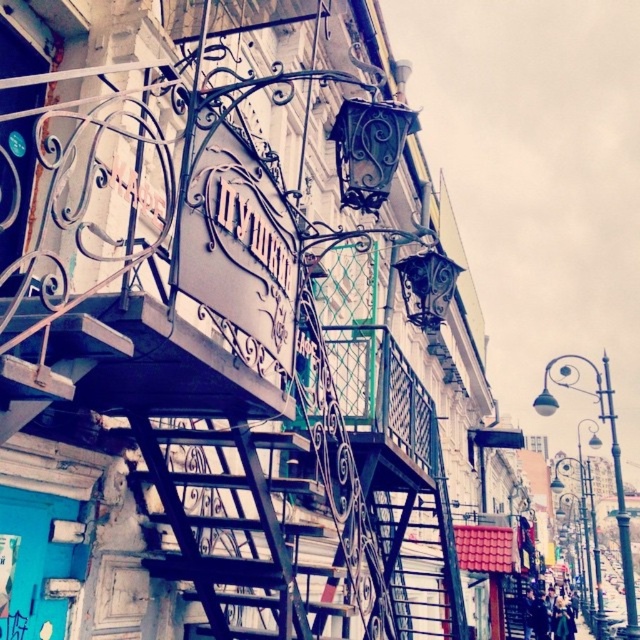
What do you see at coordinates (220, 330) in the screenshot?
I see `black wrought iron fire escape at center` at bounding box center [220, 330].

Does point (406, 636) come farther from viewer compared to point (148, 422)?

Yes, it is.

Image resolution: width=640 pixels, height=640 pixels. I want to click on black wrought iron fire escape at center, so click(220, 330).